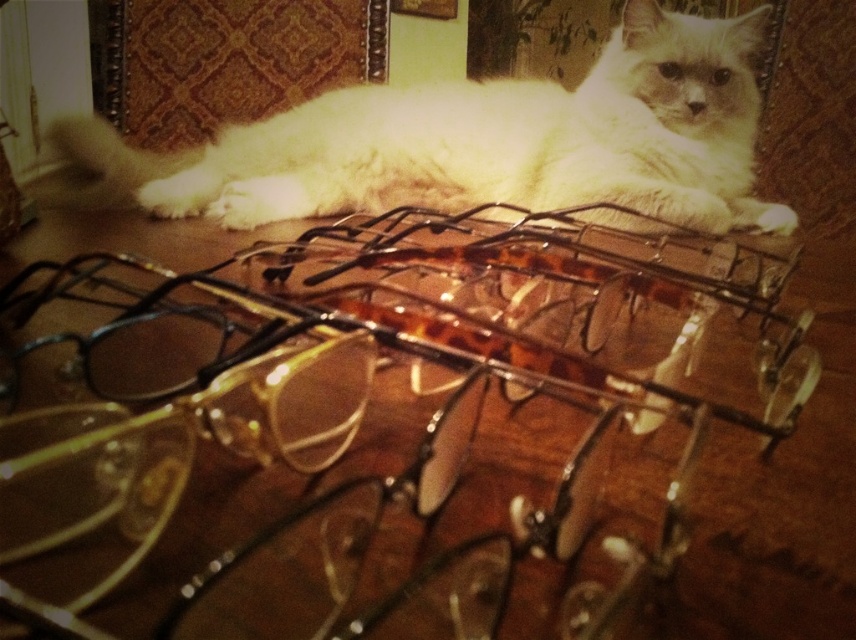
Question: Is transparent plastic glasses at center positioned behind white fluffy cat at upper center?

Choices:
 (A) no
 (B) yes

Answer: (A)

Question: Which point is closer to the camera?

Choices:
 (A) transparent plastic glasses at center
 (B) white fluffy cat at upper center

Answer: (A)

Question: Can you confirm if transparent plastic glasses at center is smaller than white fluffy cat at upper center?

Choices:
 (A) no
 (B) yes

Answer: (B)

Question: Observing the image, what is the correct spatial positioning of transparent plastic glasses at center in reference to white fluffy cat at upper center?

Choices:
 (A) left
 (B) right

Answer: (A)